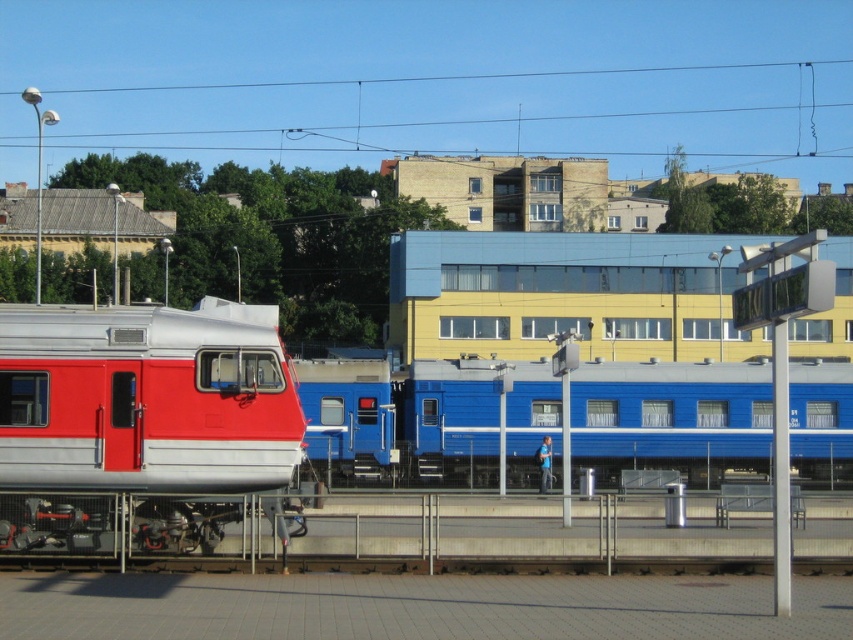
Question: Can you confirm if blue glossy train car at center is smaller than metallic red train at left?

Choices:
 (A) no
 (B) yes

Answer: (A)

Question: Is blue glossy train car at center below metallic wire at upper center?

Choices:
 (A) yes
 (B) no

Answer: (A)

Question: Based on their relative distances, which object is nearer to the metallic red train at left?

Choices:
 (A) metallic wire at upper center
 (B) blue glossy train car at center

Answer: (B)

Question: Is metallic red train at left positioned at the back of metallic wire at upper center?

Choices:
 (A) yes
 (B) no

Answer: (B)

Question: Which point is closer to the camera?

Choices:
 (A) (65, 467)
 (B) (262, 88)
 (C) (357, 364)

Answer: (A)

Question: Which of the following is the closest to the observer?

Choices:
 (A) metallic red train at left
 (B) blue glossy train car at center
 (C) metallic wire at upper center

Answer: (A)